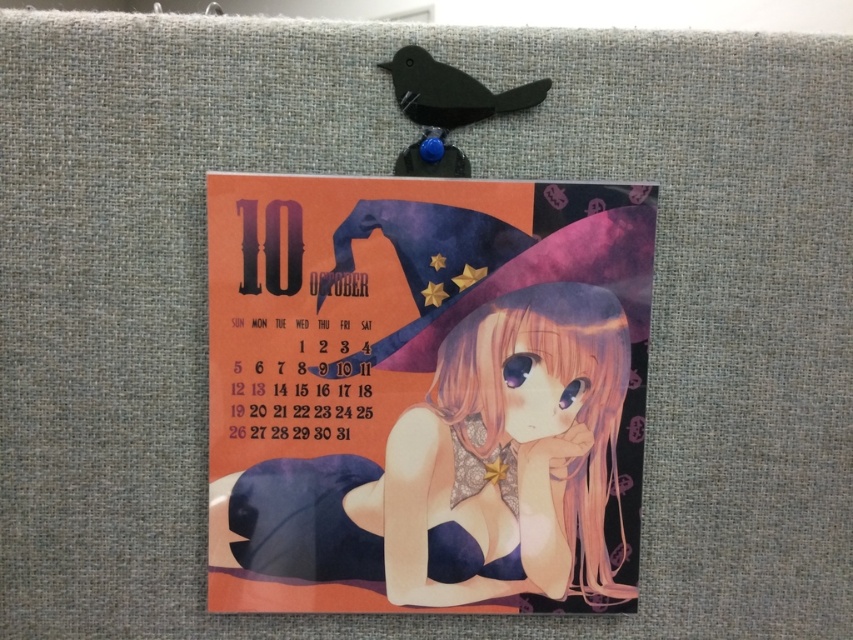
Consider the image. Between smooth paper calendar at center and matte black bird at upper center, which one appears on the right side from the viewer's perspective?

matte black bird at upper center is more to the right.

Is the position of smooth paper calendar at center less distant than that of matte black bird at upper center?

No, smooth paper calendar at center is further to the viewer.

Between point (575, 408) and point (412, 80), which one is positioned in front?

Point (412, 80)

Find the location of a particular element. This screenshot has height=640, width=853. smooth paper calendar at center is located at coordinates (463, 468).